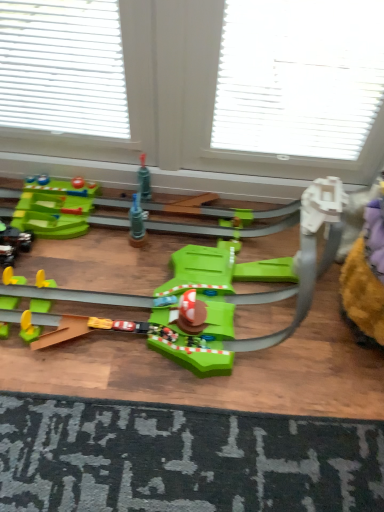
Question: In the image, is green plastic toy at center, positioned as the 1th toy in top-to-bottom order, positioned in front of or behind dark gray textured doormat at bottom?

Choices:
 (A) behind
 (B) front

Answer: (B)

Question: Visually, is green plastic toy at center, arranged as the 1th toy when viewed from the front, positioned to the left or to the right of dark gray textured doormat at bottom?

Choices:
 (A) left
 (B) right

Answer: (A)

Question: Which of these objects is positioned closest to the shiny black car at left, arranged as the 2th toy when viewed from the top?

Choices:
 (A) dark gray textured doormat at bottom
 (B) green plastic toy at center, the 2th toy viewed from the left

Answer: (B)

Question: Considering the real-world distances, which object is closest to the dark gray textured doormat at bottom?

Choices:
 (A) green plastic toy at center, the 1th toy from the right
 (B) shiny black car at left, acting as the 1th toy starting from the left

Answer: (A)